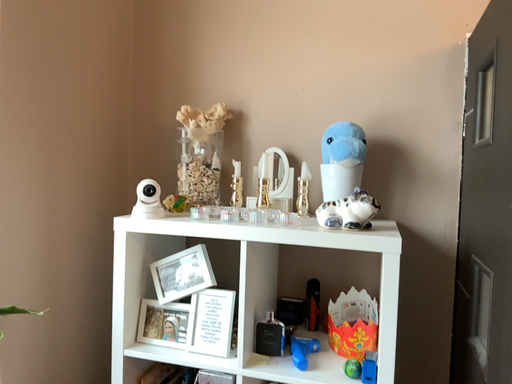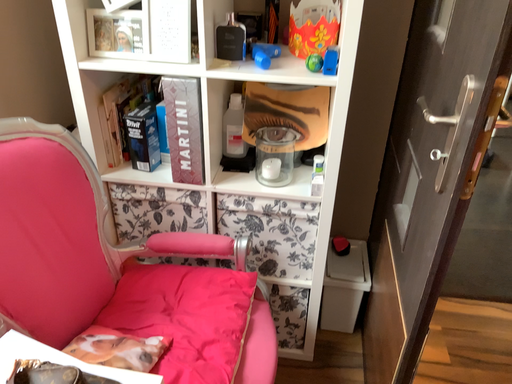
Question: Which way did the camera rotate in the video?

Choices:
 (A) rotated right
 (B) rotated left

Answer: (A)